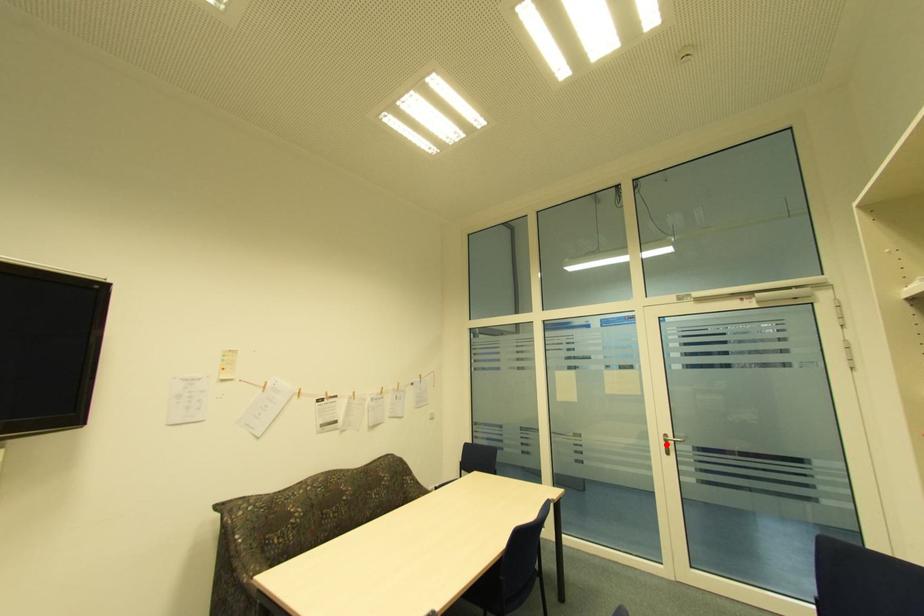
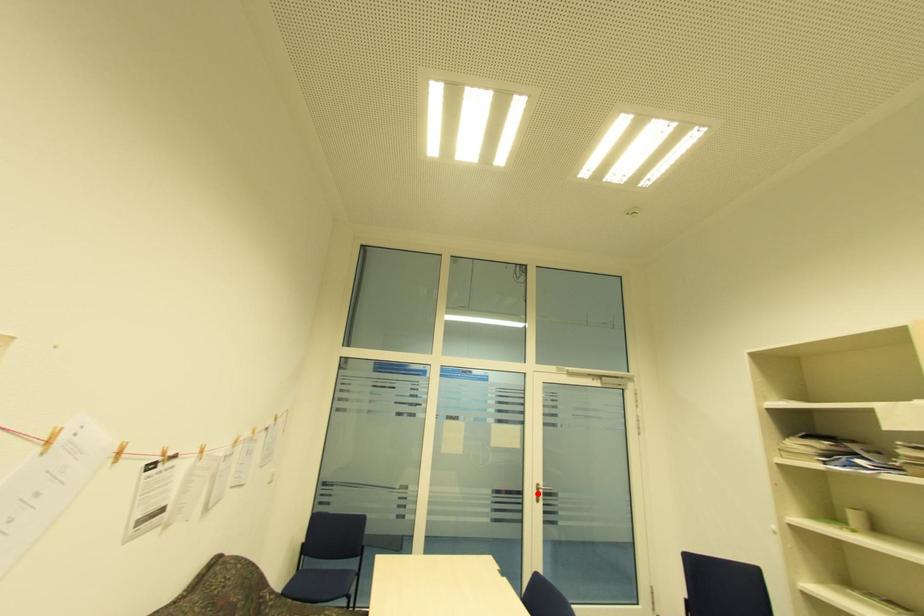
I am providing you with two images of the same scene from different viewpoints. A red point is marked on the first image and another point is marked on the second image. Is the marked point in image1 the same physical position as the marked point in image2?

Yes